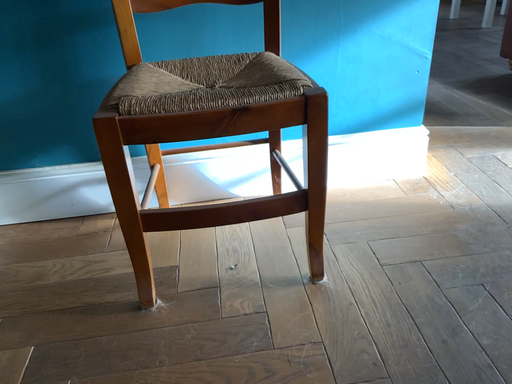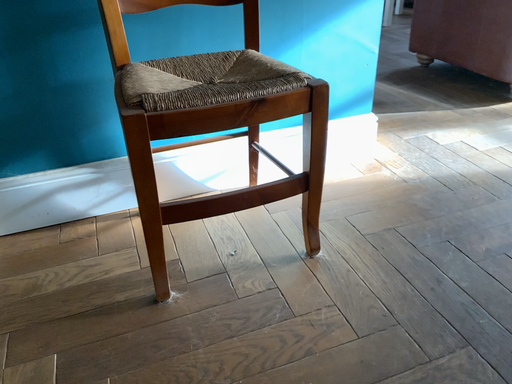
Question: How did the camera likely rotate when shooting the video?

Choices:
 (A) rotated right
 (B) rotated left

Answer: (A)